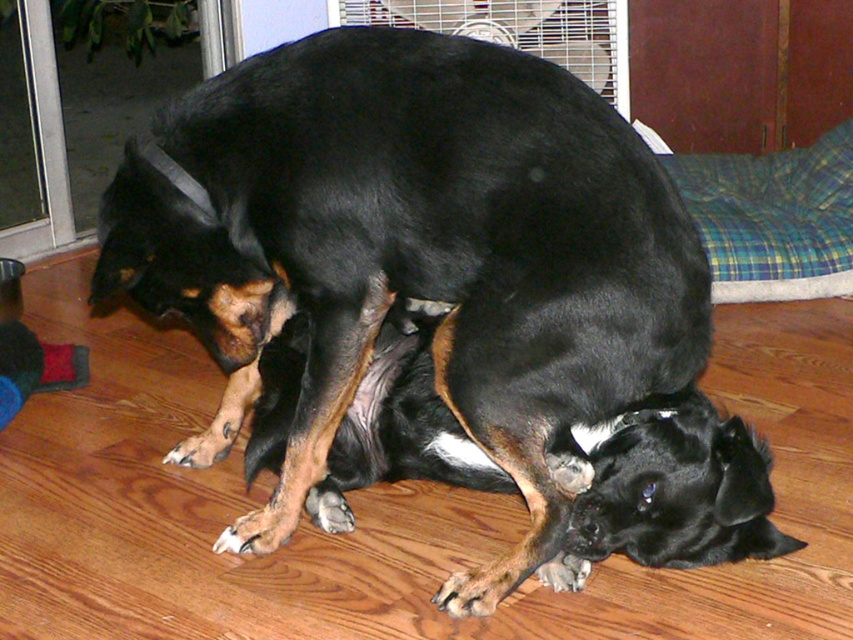
Question: Which object appears closest to the camera in this image?

Choices:
 (A) plaid fabric dog bed at upper right
 (B) black smooth dog at center

Answer: (B)

Question: Which point is closer to the camera?

Choices:
 (A) (717, 284)
 (B) (485, 272)

Answer: (B)

Question: Does black smooth dog at center lie in front of plaid fabric dog bed at upper right?

Choices:
 (A) no
 (B) yes

Answer: (B)

Question: Can you confirm if black smooth dog at center is positioned to the right of plaid fabric dog bed at upper right?

Choices:
 (A) no
 (B) yes

Answer: (A)

Question: Which object appears closest to the camera in this image?

Choices:
 (A) plaid fabric dog bed at upper right
 (B) black smooth dog at center

Answer: (B)

Question: Can you confirm if black smooth dog at center is positioned above plaid fabric dog bed at upper right?

Choices:
 (A) no
 (B) yes

Answer: (A)